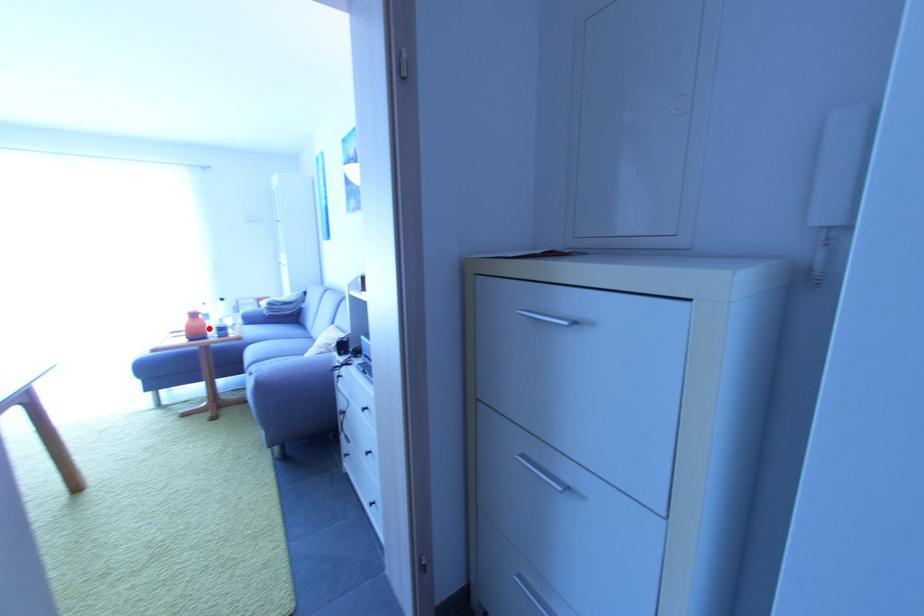
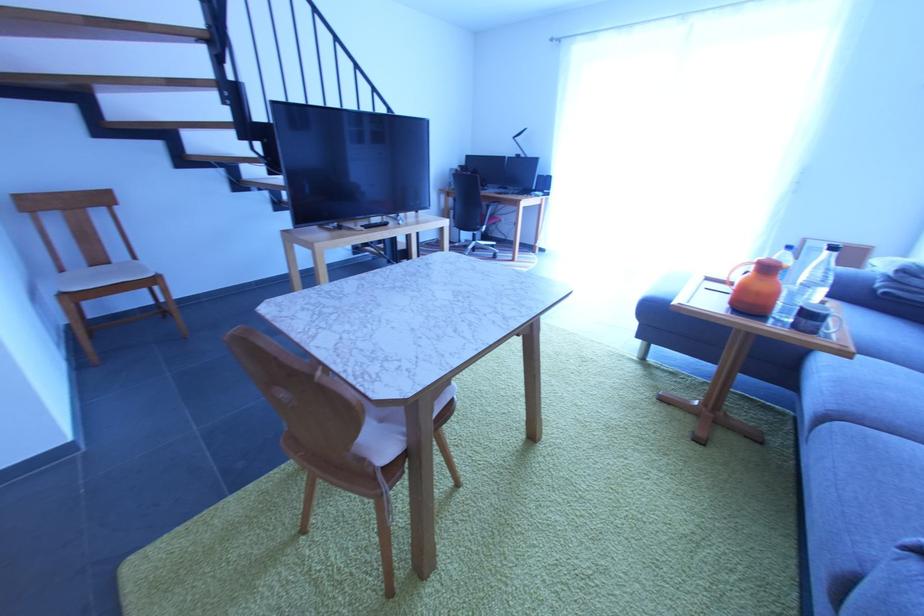
The point at the highlighted location is marked in the first image. Where is the corresponding point in the second image?

(779, 297)